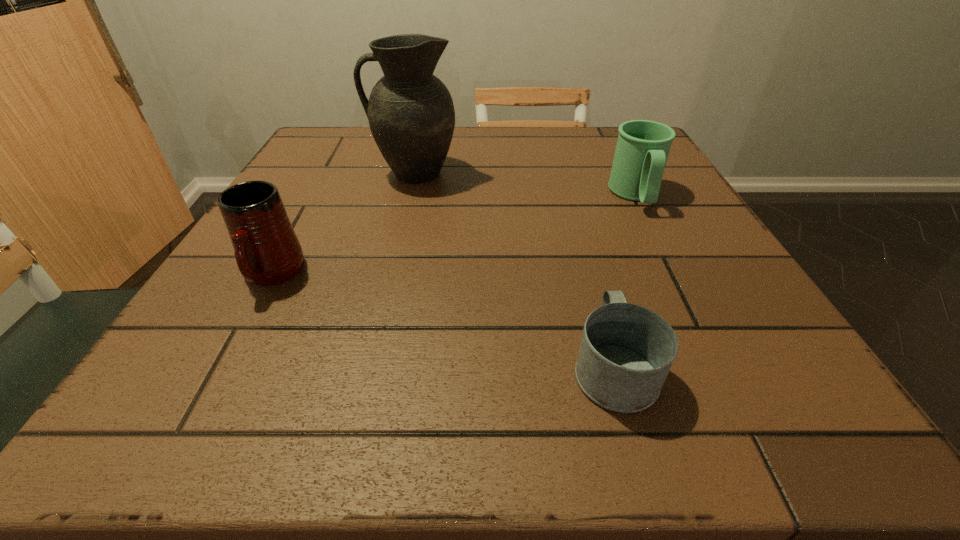
The image size is (960, 540). I want to click on vacant space at the left edge of the desktop, so click(301, 216).

This screenshot has height=540, width=960. Identify the location of vacant space at the far left corner of the desktop. coord(307,146).

Locate an element on the screen. vacant space at the far right corner of the desktop is located at coordinates (604, 162).

The width and height of the screenshot is (960, 540). In the image, there is a desktop. What are the coordinates of `vacant region at the near right corner` in the screenshot? It's located at (715, 426).

The height and width of the screenshot is (540, 960). I want to click on free space between the tallest object and the leftmost mug, so click(x=343, y=224).

You are a GUI agent. You are given a task and a screenshot of the screen. Output one action in this format:
    pyautogui.click(x=<x>, y=<y>)
    Task: Click on the free space between the leftmost object and the second object from left to right
    
    Given the screenshot: What is the action you would take?
    pyautogui.click(x=343, y=224)

The width and height of the screenshot is (960, 540). Find the location of `free spot between the nearest object and the leftmost mug`. free spot between the nearest object and the leftmost mug is located at coordinates (443, 321).

Find the location of a particular element. The height and width of the screenshot is (540, 960). vacant point located between the tallest object and the nearest mug is located at coordinates (514, 270).

Locate an element on the screen. Image resolution: width=960 pixels, height=540 pixels. vacant area that lies between the second mug from left to right and the third farthest object is located at coordinates (443, 321).

Where is `free space between the leftmost object and the tallest object`? free space between the leftmost object and the tallest object is located at coordinates (343, 224).